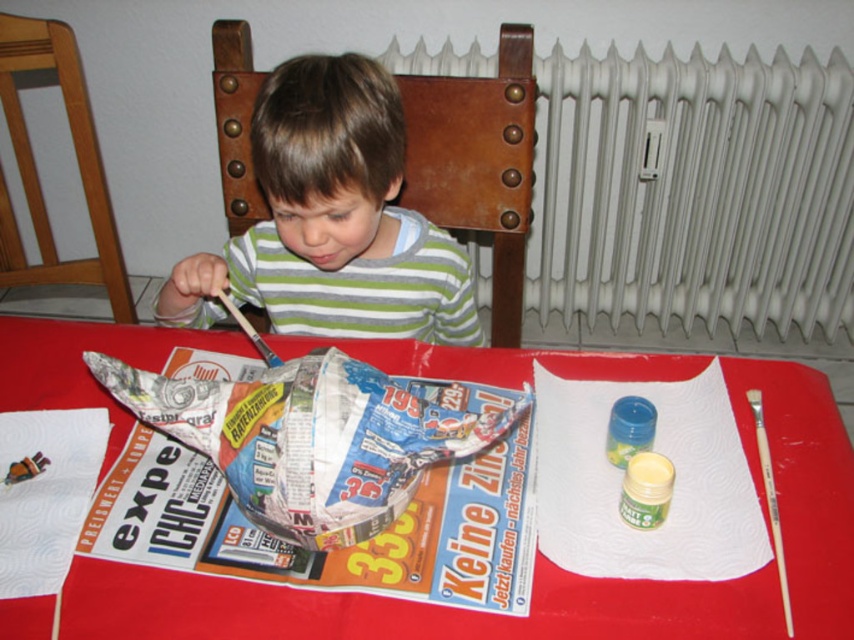
You are a parent trying to set up a craft station for your child. The red paper table at center and wooden chair at left are in the room. Which one should you adjust to make the table higher?

The red paper table at center is not as tall as the wooden chair at left. To make the table higher, you should adjust the red paper table at center.

You are a painter standing in front of the table with the red cloth. You need to place a new paint jar between the two points labeled point (816, 275) and point (104, 212). Which point should you place it closer to so that it is closer to the viewer?

You should place the new paint jar closer to point (816, 275) because it is closer to the viewer than point (104, 212).

You are a photographer taking a picture of the scene. The camera is focused on the newspaper bowl. There is a point at coordinate point (571,600). Is this point in focus?

The point at coordinate point (571,600) is 25.99 inches away from the camera. Since the camera is focused on the newspaper bowl, which is presumably at a different distance, this point may or may not be in focus depending on the depth of field. However, based on the given information, we cannot determine if the point is within the depth of field required for sharp focus.